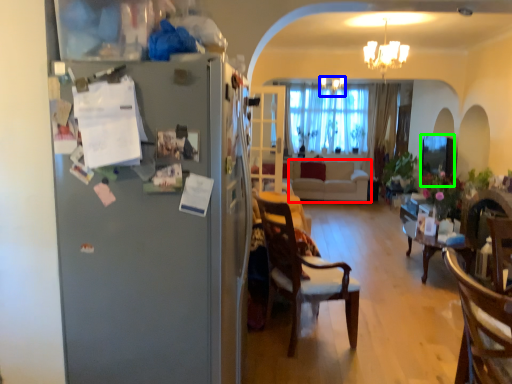
Question: Based on their relative distances, which object is farther from studio couch (highlighted by a red box)? Choose from light fixture (highlighted by a blue box) and window screen (highlighted by a green box).

Choices:
 (A) light fixture
 (B) window screen

Answer: (A)